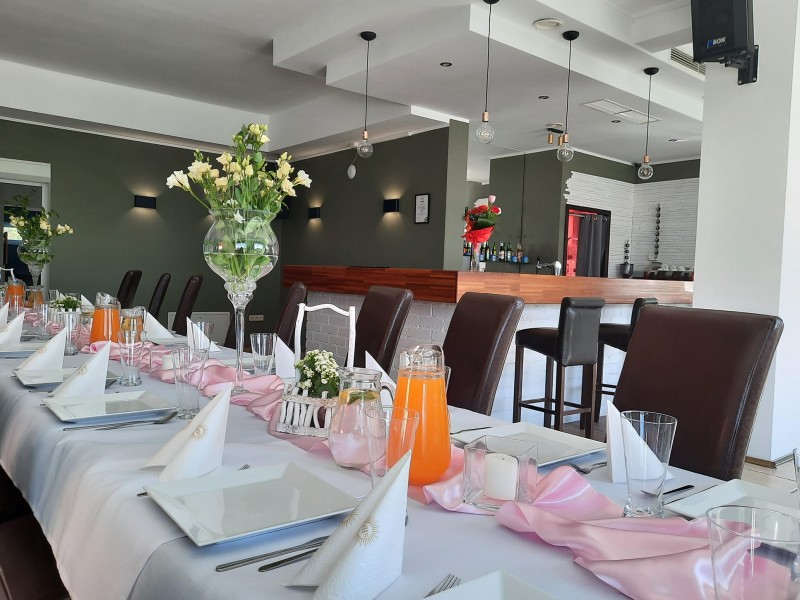
I want to click on white square plates seen, so click(x=25, y=338), click(x=58, y=375), click(x=116, y=416), click(x=244, y=503), click(x=722, y=494), click(x=541, y=459), click(x=254, y=364), click(x=176, y=336).